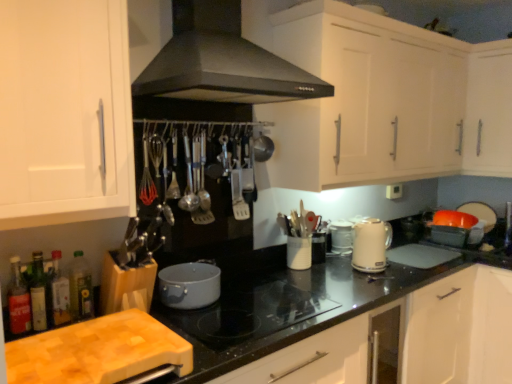
Question: Considering the relative positions of white matte cabinet at upper right, which ranks as the 1th cabinetry in top-to-bottom order, and wooden cutting board at lower left, marked as the 3th cabinetry in a top-to-bottom arrangement, in the image provided, is white matte cabinet at upper right, which ranks as the 1th cabinetry in top-to-bottom order, behind wooden cutting board at lower left, marked as the 3th cabinetry in a top-to-bottom arrangement,?

Choices:
 (A) no
 (B) yes

Answer: (B)

Question: Is white matte cabinet at upper right, which is the third cabinetry in bottom-to-top order, to the left of wooden cutting board at lower left, marked as the 3th cabinetry in a top-to-bottom arrangement, from the viewer's perspective?

Choices:
 (A) yes
 (B) no

Answer: (B)

Question: Is white matte cabinet at upper right, which ranks as the 1th cabinetry in top-to-bottom order, positioned with its back to wooden cutting board at lower left, marked as the 3th cabinetry in a top-to-bottom arrangement?

Choices:
 (A) no
 (B) yes

Answer: (A)

Question: Is white matte cabinet at upper right, which is the third cabinetry in bottom-to-top order, not close to wooden cutting board at lower left, the first cabinetry from the bottom?

Choices:
 (A) yes
 (B) no

Answer: (B)

Question: Does white matte cabinet at upper right, which ranks as the 1th cabinetry in top-to-bottom order, have a larger size compared to wooden cutting board at lower left, marked as the 3th cabinetry in a top-to-bottom arrangement?

Choices:
 (A) yes
 (B) no

Answer: (B)

Question: Is white matte cabinet at upper right, which is the third cabinetry in bottom-to-top order, oriented towards wooden cutting board at lower left, the first cabinetry from the bottom?

Choices:
 (A) yes
 (B) no

Answer: (B)

Question: Can translucent glass bottle at lower left, arranged as the second bottle when viewed from the right, be found inside white matte cabinet at left, acting as the second cabinetry starting from the top?

Choices:
 (A) no
 (B) yes

Answer: (A)

Question: Is white matte cabinet at left, acting as the second cabinetry starting from the top, with translucent glass bottle at lower left, the third bottle in the left-to-right sequence?

Choices:
 (A) yes
 (B) no

Answer: (B)

Question: From a real-world perspective, does white matte cabinet at left, the 2th cabinetry positioned from the bottom, stand above translucent glass bottle at lower left, arranged as the second bottle when viewed from the right?

Choices:
 (A) no
 (B) yes

Answer: (B)

Question: Can you confirm if white matte cabinet at left, acting as the second cabinetry starting from the top, is shorter than translucent glass bottle at lower left, the third bottle in the left-to-right sequence?

Choices:
 (A) no
 (B) yes

Answer: (A)

Question: Is white matte cabinet at left, the 2th cabinetry positioned from the bottom, positioned before translucent glass bottle at lower left, the third bottle in the left-to-right sequence?

Choices:
 (A) yes
 (B) no

Answer: (A)

Question: Is the position of white matte cabinet at left, acting as the second cabinetry starting from the top, more distant than that of translucent glass bottle at lower left, the third bottle in the left-to-right sequence?

Choices:
 (A) yes
 (B) no

Answer: (B)

Question: Does translucent glass bottle at lower left, which is the third bottle from right to left, touch green matte bottle at lower left, which is the fourth bottle in left-to-right order?

Choices:
 (A) yes
 (B) no

Answer: (B)